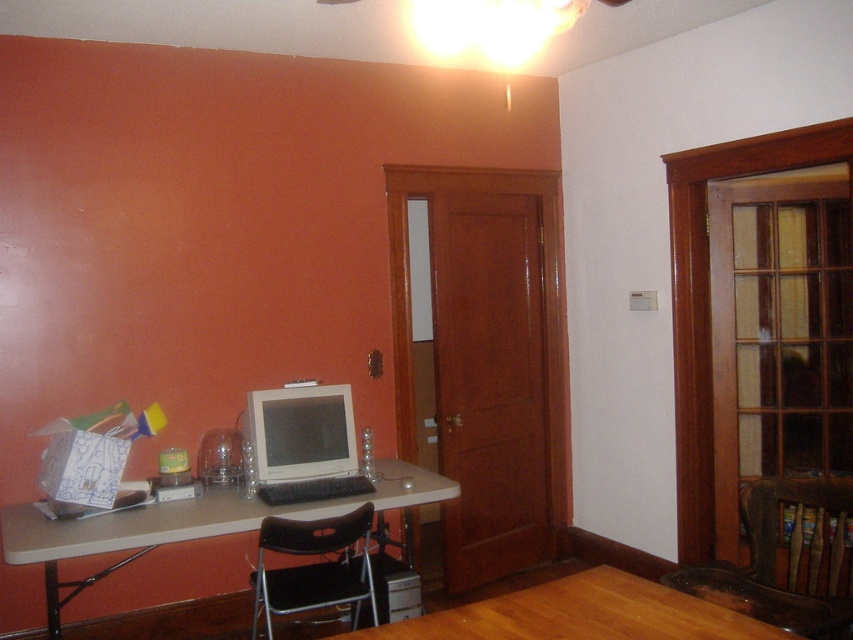
Who is more forward, (x=825, y=605) or (x=305, y=451)?

Point (x=825, y=605)

This screenshot has width=853, height=640. Find the location of `brown leather chair at lower right`. brown leather chair at lower right is located at coordinates (787, 557).

Between black fabric chair at lower center and white glossy computer monitor at center, which one is positioned lower?

black fabric chair at lower center

Does black fabric chair at lower center appear on the right side of white glossy computer monitor at center?

Indeed, black fabric chair at lower center is positioned on the right side of white glossy computer monitor at center.

Is point (277, 595) farther from viewer compared to point (264, 428)?

No, it is not.

This screenshot has width=853, height=640. Find the location of `black fabric chair at lower center`. black fabric chair at lower center is located at coordinates (312, 566).

Is matte plastic table at left taller than white glossy computer monitor at center?

Yes, matte plastic table at left is taller than white glossy computer monitor at center.

You are a GUI agent. You are given a task and a screenshot of the screen. Output one action in this format:
    pyautogui.click(x=<x>, y=<y>)
    Task: Click on the matte plastic table at left
    This screenshot has height=640, width=853.
    Given the screenshot: What is the action you would take?
    pyautogui.click(x=183, y=525)